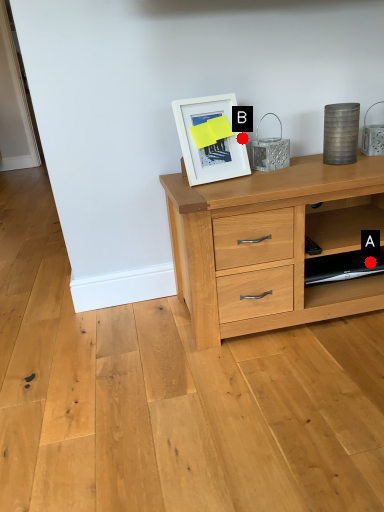
Question: Two points are circled on the image, labeled by A and B beside each circle. Which point is further to the camera?

Choices:
 (A) A is further
 (B) B is further

Answer: (A)